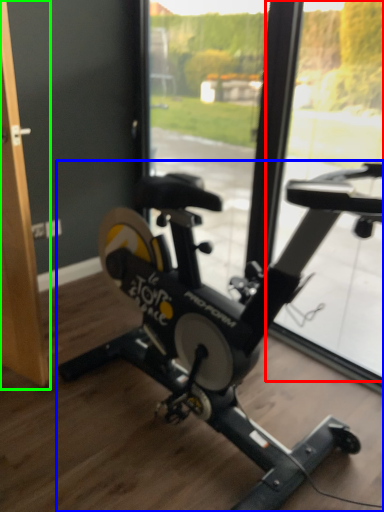
Question: Estimate the real-world distances between objects in this image. Which object is farther from window screen (highlighted by a red box), stationary bicycle (highlighted by a blue box) or screen door (highlighted by a green box)?

Choices:
 (A) stationary bicycle
 (B) screen door

Answer: (B)